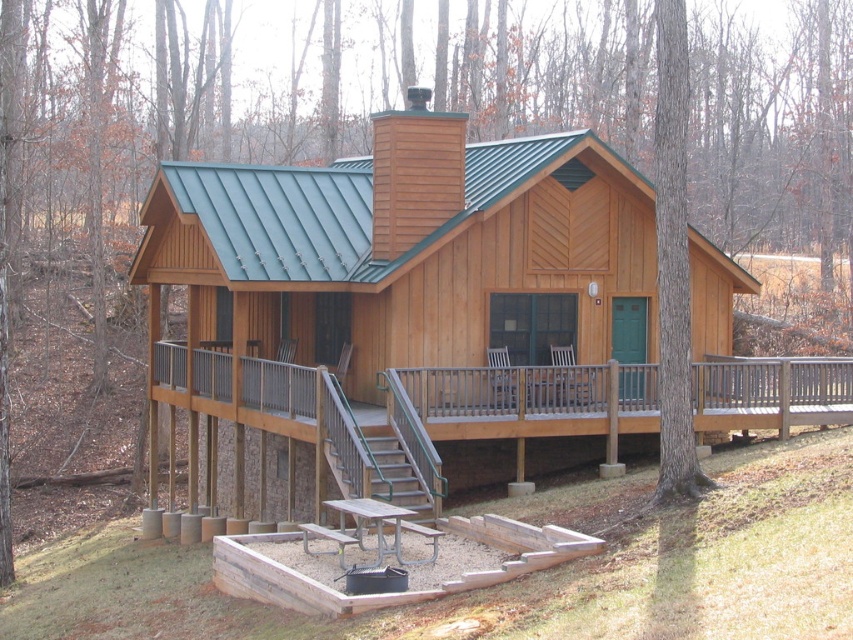
Question: Which object is closer to the camera taking this photo?

Choices:
 (A) brown wooden porch at lower center
 (B) metallic gray stairs at center

Answer: (A)

Question: Is brown wooden porch at lower center further to the viewer compared to metallic gray stairs at center?

Choices:
 (A) yes
 (B) no

Answer: (B)

Question: Among these objects, which one is nearest to the camera?

Choices:
 (A) metallic gray stairs at center
 (B) brown wooden porch at lower center

Answer: (B)

Question: Is brown wooden porch at lower center to the left of metallic gray stairs at center from the viewer's perspective?

Choices:
 (A) yes
 (B) no

Answer: (B)

Question: Among these points, which one is nearest to the camera?

Choices:
 (A) (393, 468)
 (B) (194, 394)

Answer: (A)

Question: Does brown wooden porch at lower center appear on the left side of metallic gray stairs at center?

Choices:
 (A) yes
 (B) no

Answer: (B)